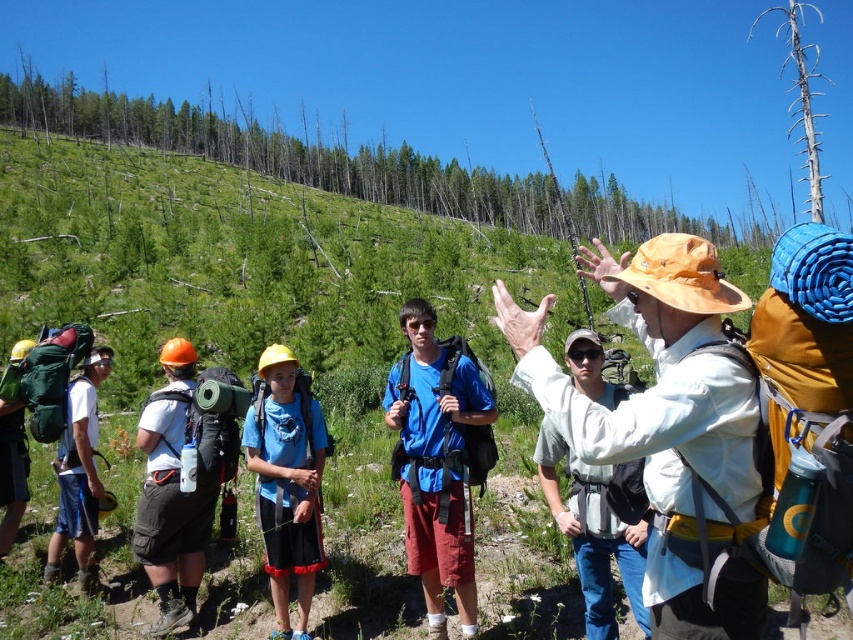
You are part of the hiking group and need to locate the person wearing the blue matte shirt at center. According to the coordinates provided, where exactly is this person positioned in the image?

The blue matte shirt at center is located at point coordinates of 0.722 on the x axis and 0.511 on the y axis.

You are part of a hiking group and need to navigate through the sparse vegetation area. There are two points marked on your map as point 1 at coordinates (x=666, y=605) and point 2 at coordinates (x=225, y=461). According to the map, which point is closer to you when standing at the starting position?

Point 1 at coordinates (x=666, y=605) is in front of point 2 at coordinates 0.266, so it is closer to you.